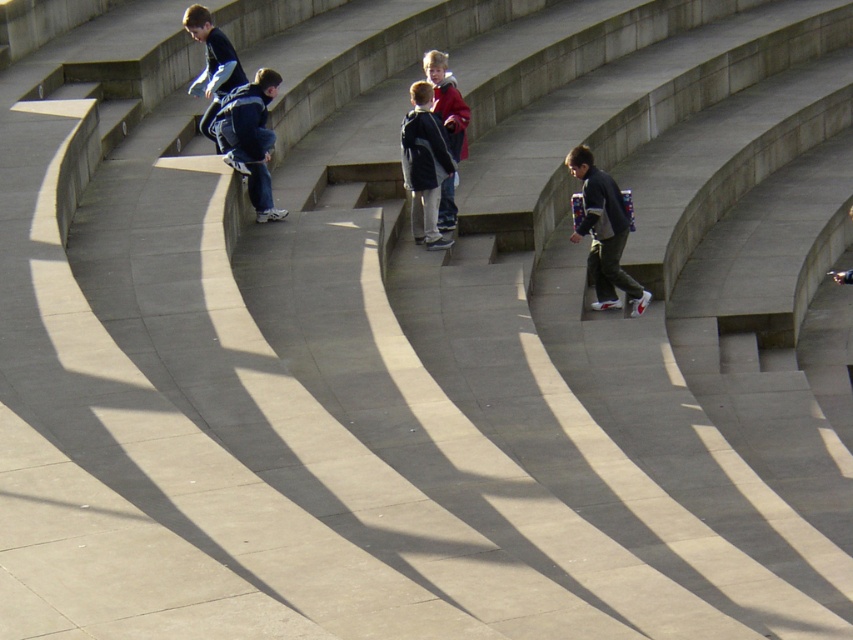
Is point (602, 216) farther from camera compared to point (248, 157)?

No, (602, 216) is closer to viewer.

I want to click on dark gray fabric backpack at center, so click(604, 234).

Which is more to the right, dark blue hoodie at center or red matte jacket at center?

red matte jacket at center

Looking at this image, is dark blue hoodie at center above red matte jacket at center?

No.

Does point (280, 212) lie behind point (448, 196)?

No, (280, 212) is in front of (448, 196).

I want to click on dark blue hoodie at center, so click(x=250, y=138).

Does dark gray fabric backpack at center have a greater height compared to dark blue jacket at center?

No, dark gray fabric backpack at center is not taller than dark blue jacket at center.

Can you confirm if dark gray fabric backpack at center is smaller than dark blue jacket at center?

No, dark gray fabric backpack at center is not smaller than dark blue jacket at center.

Identify the location of dark gray fabric backpack at center. (604, 234).